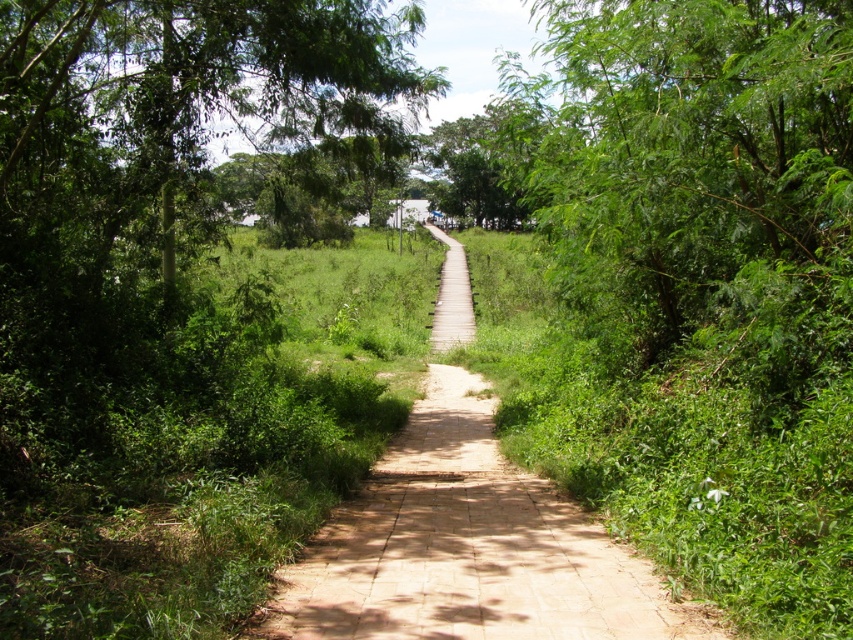
Question: Which object appears closest to the camera in this image?

Choices:
 (A) green leafy tree at upper left
 (B) green leafy tree at upper right

Answer: (B)

Question: Which point is closer to the camera taking this photo?

Choices:
 (A) (126, 234)
 (B) (611, 92)

Answer: (B)

Question: Does green leafy tree at upper right have a lesser width compared to green leafy tree at upper left?

Choices:
 (A) yes
 (B) no

Answer: (B)

Question: Does green leafy tree at upper right appear over green leafy tree at upper left?

Choices:
 (A) no
 (B) yes

Answer: (B)

Question: Does green leafy tree at upper right appear on the right side of green leafy tree at upper left?

Choices:
 (A) yes
 (B) no

Answer: (A)